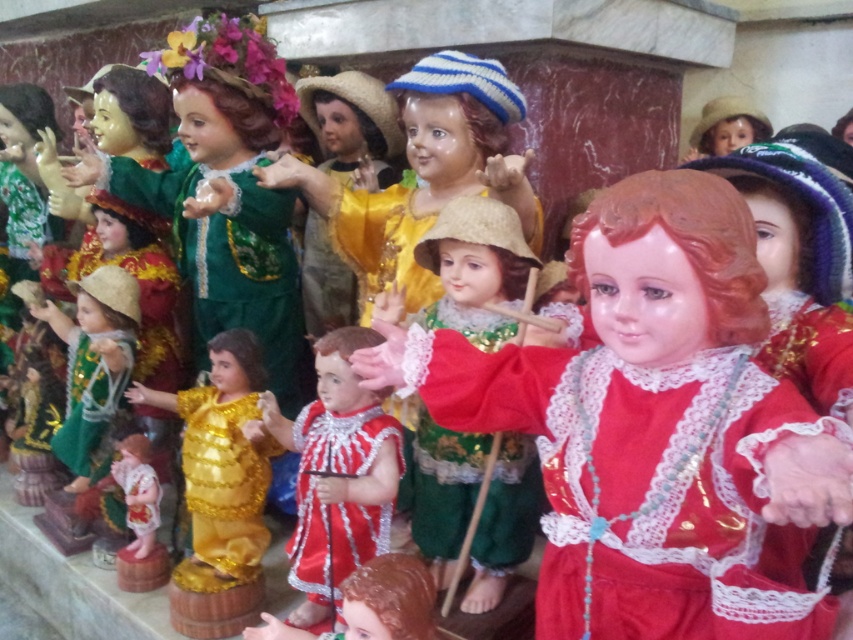
In the scene shown: You are an art curator arranging a display. You need to place a new figurine between the shiny red porcelain doll at center and the shiny green fabric doll at center. Where should you place it to maintain the vertical arrangement?

You should place the new figurine between the shiny red porcelain doll at center and the shiny green fabric doll at center vertically since the shiny red porcelain doll at center is above the shiny green fabric doll at center.

You are a collector examining two dolls in the center of the image. Which doll is closer to you, the shiny red porcelain doll at center or the shiny green fabric doll at center?

The shiny red porcelain doll at center is closer to you because it is in front of the shiny green fabric doll at center.